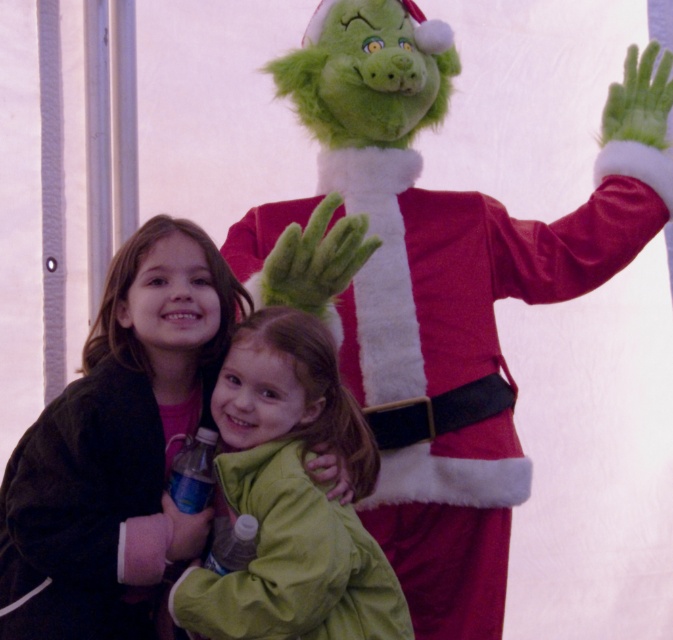
From the picture: Who is higher up, fuzzy red santa at center or matte green jacket at center?

fuzzy red santa at center

Is fuzzy red santa at center positioned in front of matte green jacket at center?

No, it is behind matte green jacket at center.

Find the location of a particular element. This screenshot has height=640, width=673. fuzzy red santa at center is located at coordinates tap(460, 269).

Where is `fuzzy red santa at center`? fuzzy red santa at center is located at coordinates (460, 269).

You are a GUI agent. You are given a task and a screenshot of the screen. Output one action in this format:
    pyautogui.click(x=<x>, y=<y>)
    Task: Click on the fuzzy red santa at center
    The image size is (673, 640).
    Given the screenshot: What is the action you would take?
    pyautogui.click(x=460, y=269)

Does fuzzy red santa at center appear on the left side of green fuzzy coat at center?

In fact, fuzzy red santa at center is to the right of green fuzzy coat at center.

Who is more distant from viewer, [466,204] or [264,403]?

The point [466,204] is more distant.

Identify the location of fuzzy red santa at center. (460, 269).

How much distance is there between matte green jacket at center and green fuzzy coat at center?

matte green jacket at center is 16.12 inches from green fuzzy coat at center.

How much distance is there between matte green jacket at center and green fuzzy coat at center?

16.12 inches

Who is more forward, (x=345, y=276) or (x=258, y=582)?

Point (x=258, y=582) is more forward.

At what (x,y) coordinates should I click in order to perform the action: click on matte green jacket at center. Please return your answer as a coordinate pair (x, y). This screenshot has height=640, width=673. Looking at the image, I should click on (116, 445).